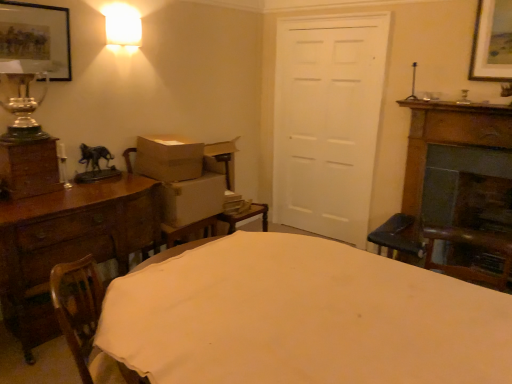
Question: Considering the relative sizes of wooden chest of drawers at left and white cardboard box at left, which is the first cardboard box from bottom to top, in the image provided, is wooden chest of drawers at left taller than white cardboard box at left, which is the first cardboard box from bottom to top,?

Choices:
 (A) yes
 (B) no

Answer: (A)

Question: Is wooden chest of drawers at left surrounding white cardboard box at left, which is the first cardboard box from bottom to top?

Choices:
 (A) no
 (B) yes

Answer: (A)

Question: Considering the relative sizes of wooden chest of drawers at left and white cardboard box at left, which appears as the 2th cardboard box when viewed from the top, in the image provided, is wooden chest of drawers at left thinner than white cardboard box at left, which appears as the 2th cardboard box when viewed from the top,?

Choices:
 (A) yes
 (B) no

Answer: (B)

Question: Is wooden chest of drawers at left not near white cardboard box at left, which appears as the 2th cardboard box when viewed from the top?

Choices:
 (A) no
 (B) yes

Answer: (A)

Question: Would you say wooden chest of drawers at left is outside white cardboard box at left, which is the first cardboard box from bottom to top?

Choices:
 (A) yes
 (B) no

Answer: (A)

Question: Considering the positions of shiny glass vase at left and matte glass lampshade at upper left in the image, is shiny glass vase at left wider or thinner than matte glass lampshade at upper left?

Choices:
 (A) wide
 (B) thin

Answer: (A)

Question: Is shiny glass vase at left in front of or behind matte glass lampshade at upper left in the image?

Choices:
 (A) behind
 (B) front

Answer: (B)

Question: Based on their positions, is shiny glass vase at left located to the left or right of matte glass lampshade at upper left?

Choices:
 (A) left
 (B) right

Answer: (A)

Question: In terms of size, does shiny glass vase at left appear bigger or smaller than matte glass lampshade at upper left?

Choices:
 (A) small
 (B) big

Answer: (B)

Question: Is white matte door at center to the left or to the right of white cardboard box at left, which is the first cardboard box from bottom to top, in the image?

Choices:
 (A) right
 (B) left

Answer: (A)

Question: Considering the positions of point (371, 105) and point (187, 196), is point (371, 105) closer or farther from the camera than point (187, 196)?

Choices:
 (A) closer
 (B) farther

Answer: (B)

Question: Considering the positions of white matte door at center and white cardboard box at left, which appears as the 2th cardboard box when viewed from the top, in the image, is white matte door at center taller or shorter than white cardboard box at left, which appears as the 2th cardboard box when viewed from the top,?

Choices:
 (A) short
 (B) tall

Answer: (B)

Question: In terms of size, does white matte door at center appear bigger or smaller than white cardboard box at left, which appears as the 2th cardboard box when viewed from the top?

Choices:
 (A) big
 (B) small

Answer: (A)

Question: From a real-world perspective, is matte black picture frame at upper left physically located above or below brown cardboard box at center, marked as the 2th cardboard box in a bottom-to-top arrangement?

Choices:
 (A) below
 (B) above

Answer: (B)

Question: From the image's perspective, relative to brown cardboard box at center, marked as the 2th cardboard box in a bottom-to-top arrangement, is matte black picture frame at upper left above or below?

Choices:
 (A) above
 (B) below

Answer: (A)